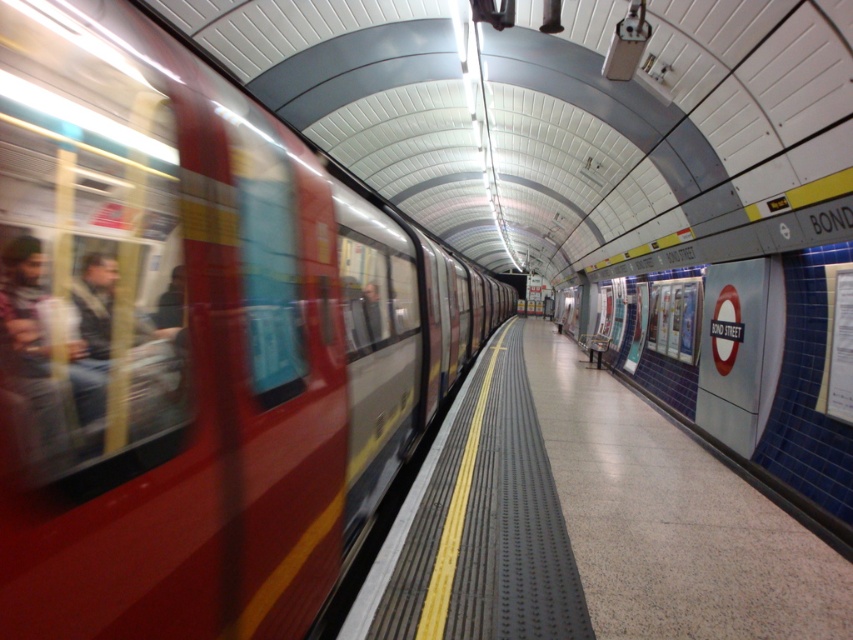
Question: Which of the following is the closest to the observer?

Choices:
 (A) metallic red train at left
 (B) polished concrete platform at center

Answer: (A)

Question: Which point is farther to the camera?

Choices:
 (A) polished concrete platform at center
 (B) metallic red train at left

Answer: (A)

Question: Which of the following is the farthest from the observer?

Choices:
 (A) (616, 419)
 (B) (345, 484)

Answer: (A)

Question: Observing the image, what is the correct spatial positioning of metallic red train at left in reference to polished concrete platform at center?

Choices:
 (A) right
 (B) left

Answer: (B)

Question: Observing the image, what is the correct spatial positioning of metallic red train at left in reference to polished concrete platform at center?

Choices:
 (A) above
 (B) below

Answer: (A)

Question: Does metallic red train at left appear under polished concrete platform at center?

Choices:
 (A) yes
 (B) no

Answer: (B)